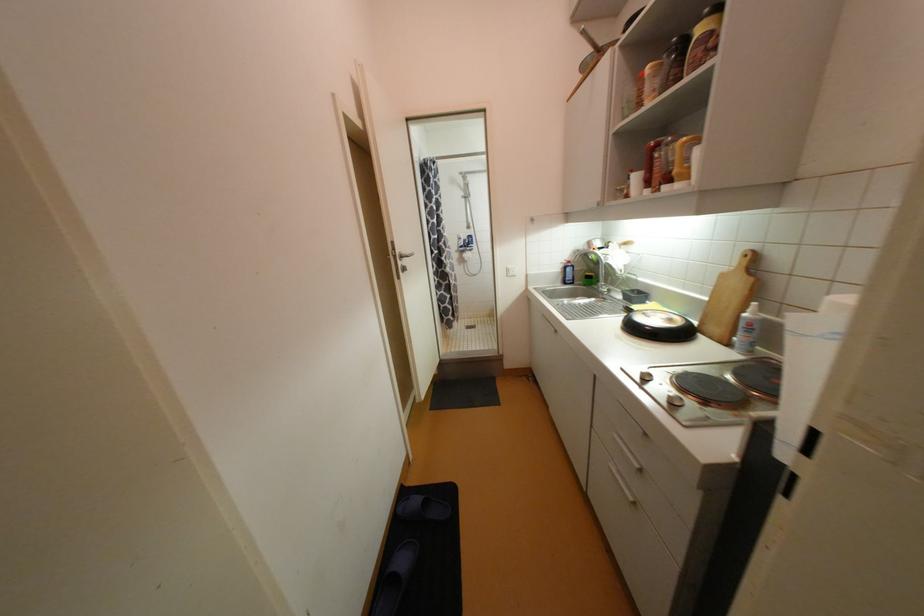
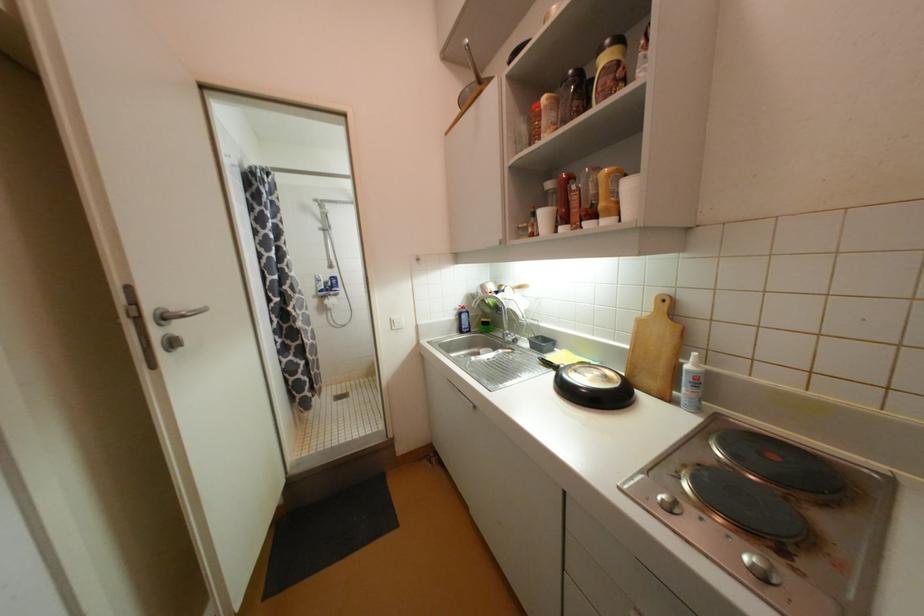
The point at [640,180] is marked in the first image. Where is the corresponding point in the second image?

(550, 216)